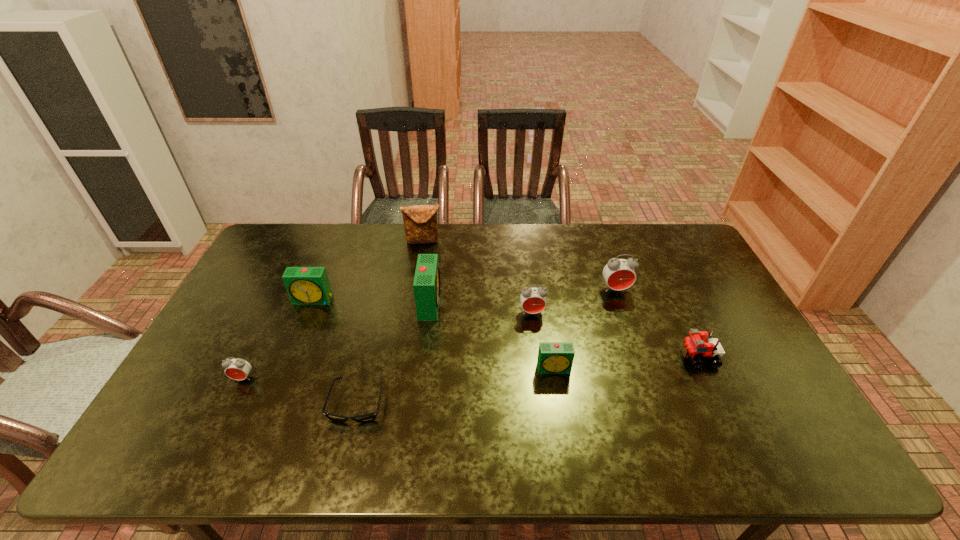
Locate an element on the screen. red alarm clock that is the closest to the fourth alarm clock from right to left is located at coordinates (533, 300).

Identify which green alarm clock is located as the nearest to the second red alarm clock from left to right. Please provide its 2D coordinates. Your answer should be formatted as a tuple, i.e. [(x, y)], where the tuple contains the x and y coordinates of a point satisfying the conditions above.

[(553, 357)]

The image size is (960, 540). In order to click on the closest green alarm clock to the shortest object in this screenshot , I will do `click(426, 285)`.